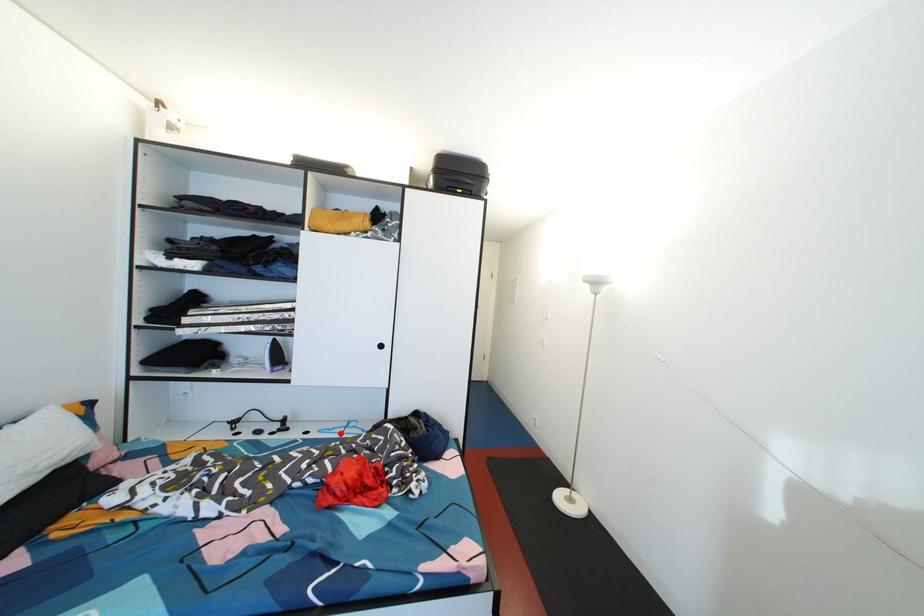
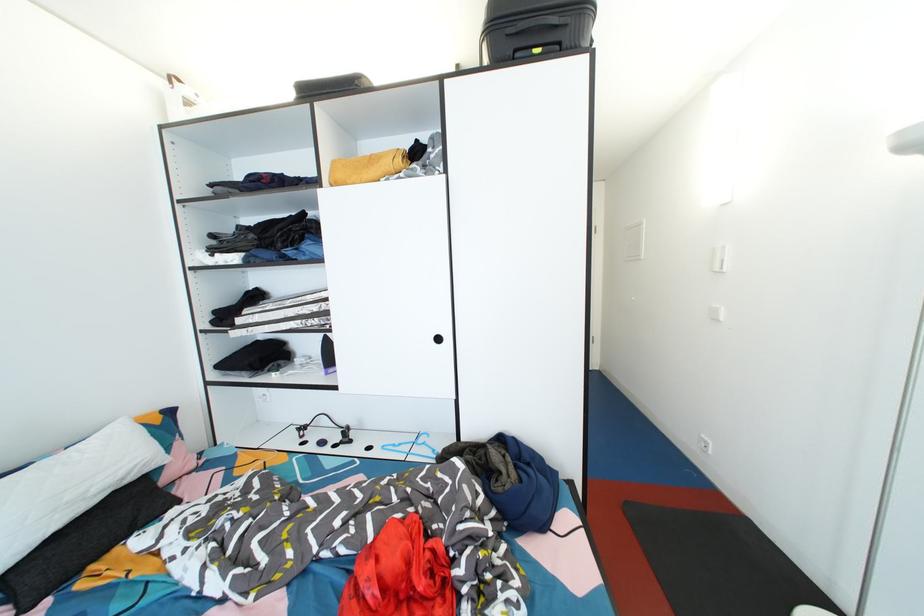
Locate, in the second image, the point that corresponds to the highlighted location in the first image.

(407, 450)